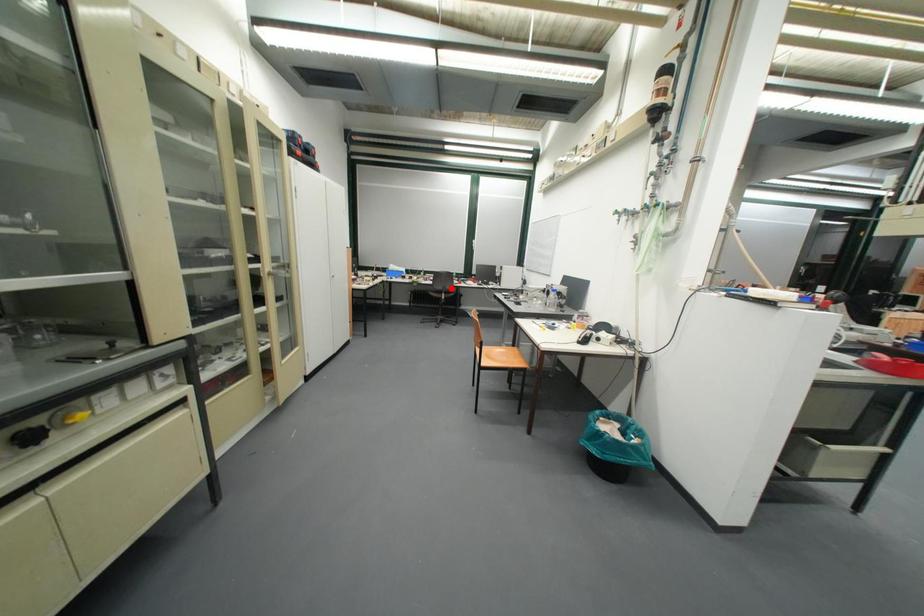
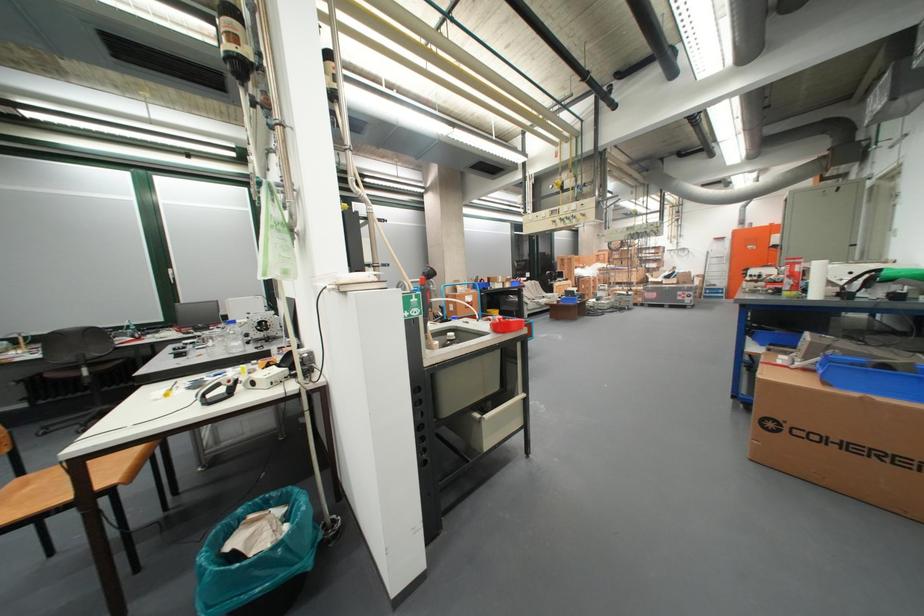
The point at the highlighted location is marked in the first image. Where is the corresponding point in the second image?

(79, 360)